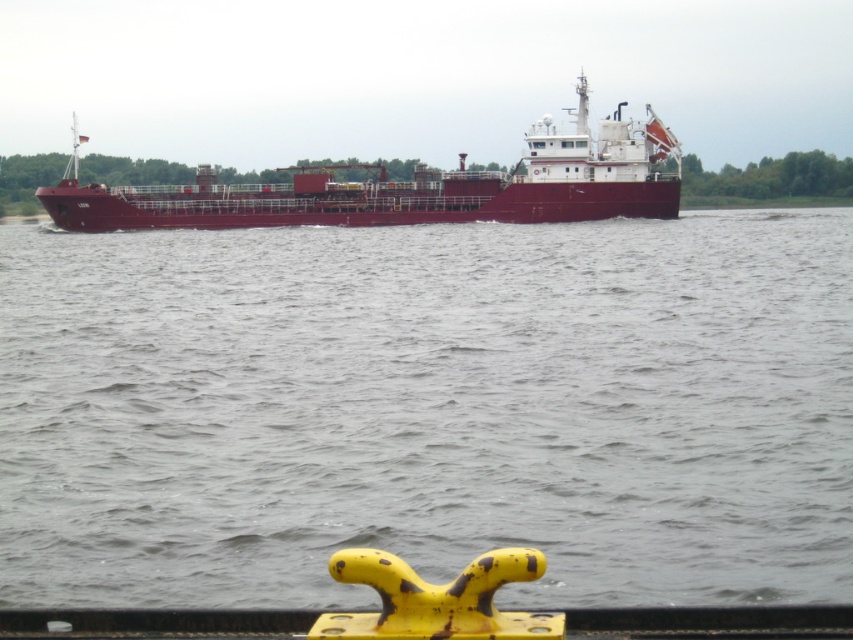
Question: Among these points, which one is nearest to the camera?

Choices:
 (A) (590, 163)
 (B) (611, 307)

Answer: (B)

Question: Among these objects, which one is farthest from the camera?

Choices:
 (A) gray water at center
 (B) maroon matte ship at center

Answer: (B)

Question: Is the position of gray water at center more distant than that of maroon matte ship at center?

Choices:
 (A) no
 (B) yes

Answer: (A)

Question: Does gray water at center have a larger size compared to maroon matte ship at center?

Choices:
 (A) no
 (B) yes

Answer: (A)

Question: Observing the image, what is the correct spatial positioning of gray water at center in reference to maroon matte ship at center?

Choices:
 (A) left
 (B) right

Answer: (B)